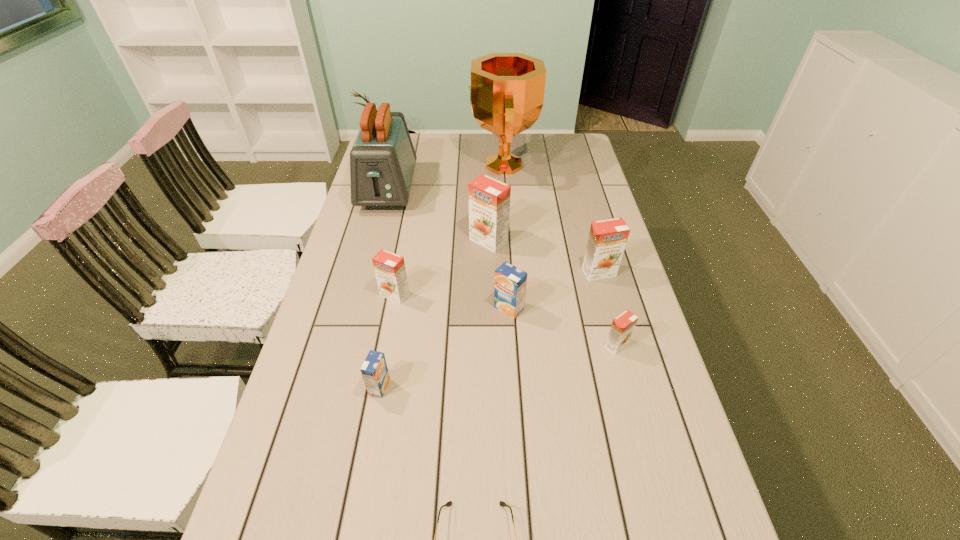
In order to click on free location located 0.270m on the back of the fourth farthest object in this screenshot , I will do `click(583, 211)`.

Find the location of `vacant area located 0.110m on the left of the leftmost orange orange juice`. vacant area located 0.110m on the left of the leftmost orange orange juice is located at coordinates (342, 295).

Locate an element on the screen. Image resolution: width=960 pixels, height=540 pixels. free location located on the back of the farther blue orange_juice is located at coordinates (507, 276).

You are a GUI agent. You are given a task and a screenshot of the screen. Output one action in this format:
    pyautogui.click(x=<x>, y=<y>)
    Task: Click on the free space located on the front of the smaller blue orange_juice
    This screenshot has width=960, height=540.
    Given the screenshot: What is the action you would take?
    pyautogui.click(x=363, y=477)

You are a GUI agent. You are given a task and a screenshot of the screen. Output one action in this format:
    pyautogui.click(x=<x>, y=<y>)
    Task: Click on the free point located 0.230m on the front of the second nearest orange juice
    
    Given the screenshot: What is the action you would take?
    pyautogui.click(x=643, y=443)

At what (x,y) coordinates should I click in order to perform the action: click on object that is at the far edge. Please return your answer as a coordinate pair (x, y). The width and height of the screenshot is (960, 540). Looking at the image, I should click on (506, 95).

Identify the location of toaster at the left edge. (382, 160).

The image size is (960, 540). Find the location of `orange juice that is at the left edge`. orange juice that is at the left edge is located at coordinates (389, 268).

The height and width of the screenshot is (540, 960). Identify the location of free space at the far edge of the desktop. coord(469,145).

In order to click on free space at the left edge of the desktop in this screenshot , I will do `click(370, 314)`.